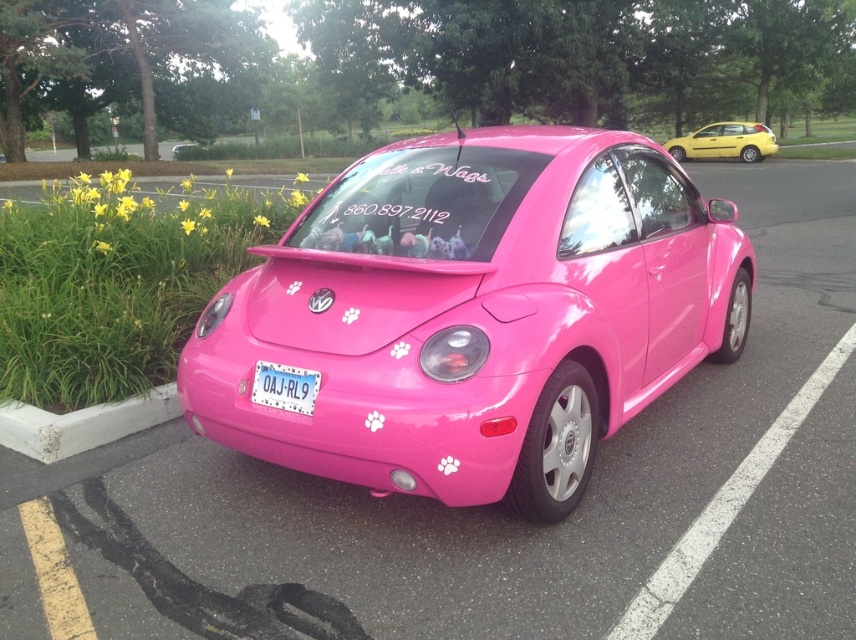
You are a delivery driver who needs to park your vehicle in the parking lot. You see the concrete at lower left and the yellow matte hatchback at upper right. Which area is suitable for parking your vehicle?

The concrete at lower left is positioned under the yellow matte hatchback at upper right, so the concrete at lower left is the suitable area for parking your vehicle as it is the ground surface.

Looking at this image, you are a delivery robot that needs to place a package on the largest available surface in the parking lot. Which object between the concrete at lower left and the pink plastic license plate at center should you choose?

The concrete at lower left is larger in size than the pink plastic license plate at center, so you should choose the concrete at lower left to place the package.

You are a delivery person trying to locate the pink plastic license plate at center. From your current position at the concrete at lower left, in which direction should you move to find it?

The concrete at lower left is to the left of the pink plastic license plate at center, so you should move to the right to find the pink plastic license plate at center.